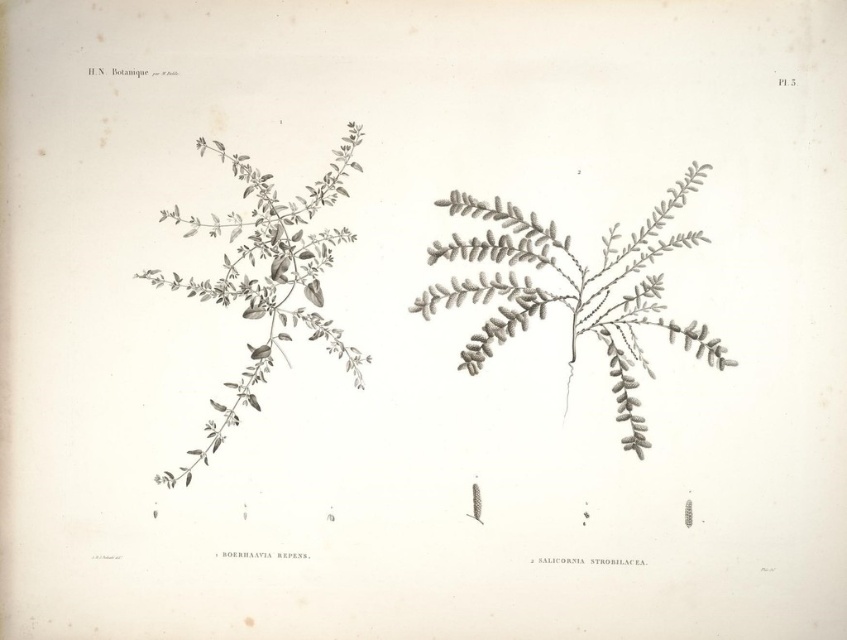
Does point (480, 364) come closer to viewer compared to point (186, 285)?

No.

Consider the image. Is gray textured plant at center to the left of gray textured plant at left from the viewer's perspective?

Incorrect, gray textured plant at center is not on the left side of gray textured plant at left.

Is point (711, 342) positioned before point (317, 237)?

Yes, it is in front of point (317, 237).

At what (x,y) coordinates should I click in order to perform the action: click on gray textured plant at center. Please return your answer as a coordinate pair (x, y). Looking at the image, I should click on (571, 289).